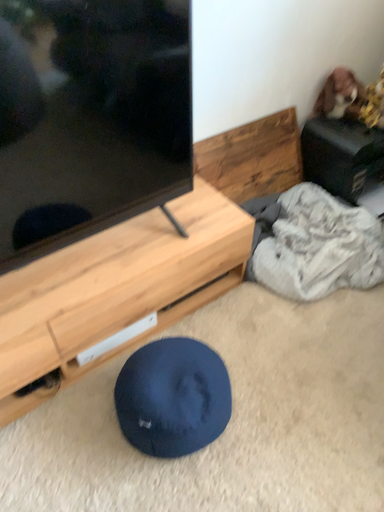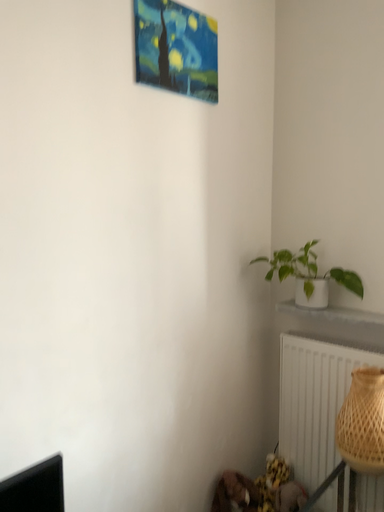
Question: How did the camera likely rotate when shooting the video?

Choices:
 (A) rotated left
 (B) rotated right

Answer: (B)